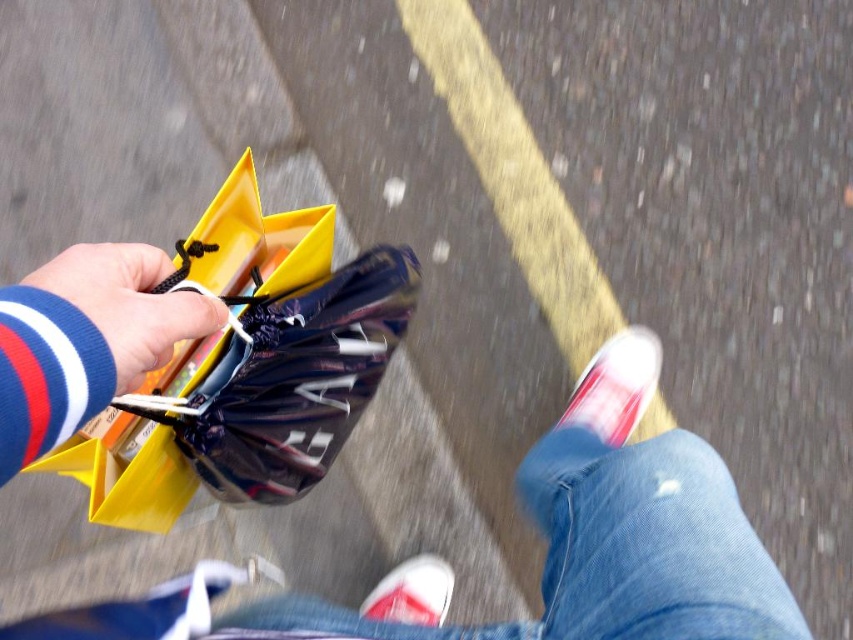
Is matte yellow bag at lower left above white canvas shoe at lower center?

Correct, matte yellow bag at lower left is located above white canvas shoe at lower center.

Does matte yellow bag at lower left have a greater height compared to white canvas shoe at lower center?

Yes, matte yellow bag at lower left is taller than white canvas shoe at lower center.

Is point (204, 321) farther from camera compared to point (422, 576)?

No, it is in front of (422, 576).

Image resolution: width=853 pixels, height=640 pixels. Identify the location of matte yellow bag at lower left. (129, 304).

In the scene shown: Is matte yellow plastic bag at lower left shorter than white canvas shoe at lower center?

In fact, matte yellow plastic bag at lower left may be taller than white canvas shoe at lower center.

Looking at this image, between matte yellow plastic bag at lower left and white canvas shoe at lower center, which one has more height?

matte yellow plastic bag at lower left is taller.

Does point (350, 333) come in front of point (408, 612)?

Yes, point (350, 333) is closer to viewer.

The width and height of the screenshot is (853, 640). What are the coordinates of `matte yellow plastic bag at lower left` in the screenshot? It's located at (291, 380).

Who is positioned more to the left, matte yellow plastic bag at lower left or white canvas shoe at lower right?

matte yellow plastic bag at lower left

Does matte yellow plastic bag at lower left have a greater width compared to white canvas shoe at lower right?

Yes, matte yellow plastic bag at lower left is wider than white canvas shoe at lower right.

Which is in front, point (326, 282) or point (579, 387)?

Positioned in front is point (326, 282).

I want to click on matte yellow plastic bag at lower left, so click(291, 380).